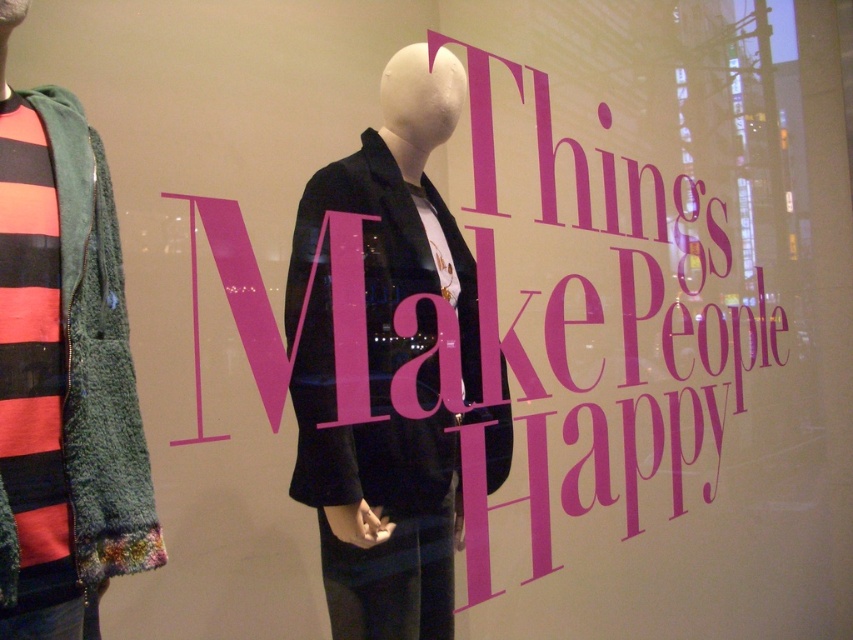
Which is in front, point (383, 276) or point (96, 228)?

Point (96, 228) is in front.

Which is more to the right, matte black jacket at center or green fuzzy jacket at left?

matte black jacket at center

Is point (305, 237) farther from camera compared to point (128, 566)?

Yes, it is behind point (128, 566).

Where is `matte black jacket at center`? This screenshot has height=640, width=853. matte black jacket at center is located at coordinates (390, 371).

Is the position of pink paper at center more distant than that of matte black jacket at center?

Yes, pink paper at center is further from the viewer.

Which is behind, point (743, 115) or point (379, 298)?

The point (743, 115) is more distant.

Which is behind, point (718, 228) or point (361, 163)?

The point (718, 228) is behind.

Locate an element on the screen. pink paper at center is located at coordinates (625, 316).

How far apart are pink paper at center and green fuzzy jacket at left?

1.17 meters

Between point (554, 333) and point (148, 518), which one is positioned behind?

Point (554, 333)

Where is `pink paper at center`? Image resolution: width=853 pixels, height=640 pixels. pink paper at center is located at coordinates (625, 316).